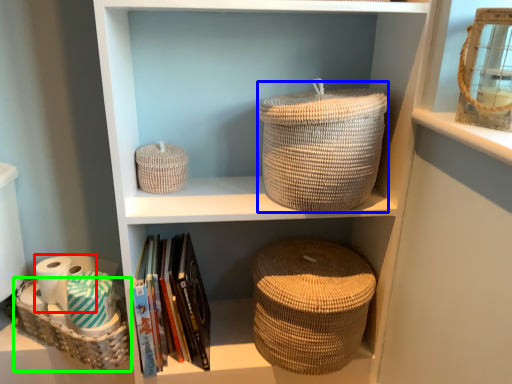
Question: Based on their relative distances, which object is farther from toilet paper (highlighted by a red box)? Choose from basket (highlighted by a blue box) and basket (highlighted by a green box).

Choices:
 (A) basket
 (B) basket

Answer: (A)